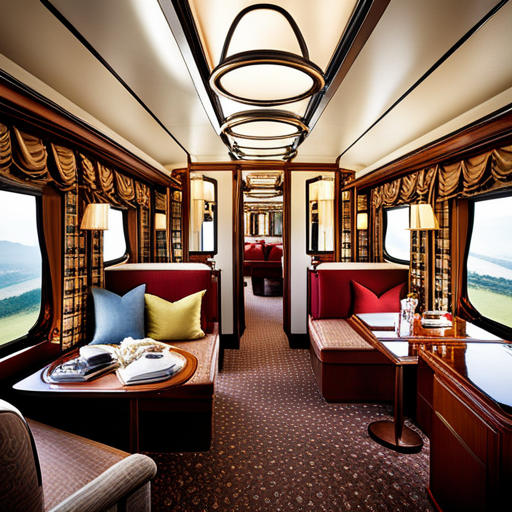
Find the location of a particular element. The width and height of the screenshot is (512, 512). windows is located at coordinates (490, 267), (395, 237), (115, 238), (10, 224).